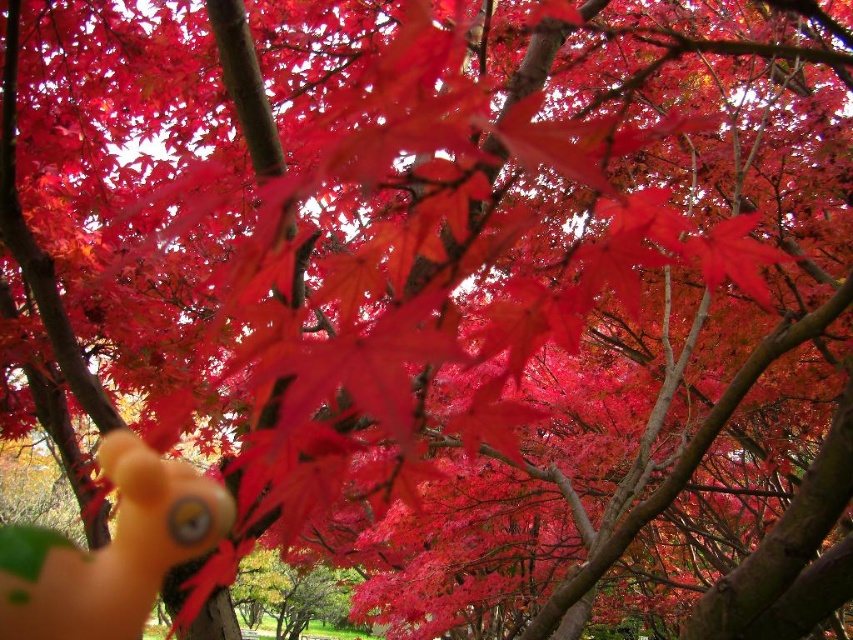
Question: Which point is closer to the camera?

Choices:
 (A) (117, 518)
 (B) (747, 291)

Answer: (A)

Question: Among these objects, which one is nearest to the camera?

Choices:
 (A) glossy red maple leaf at upper right
 (B) rubber duck at lower left

Answer: (B)

Question: Can you confirm if rubber duck at lower left is positioned to the left of glossy red maple leaf at upper right?

Choices:
 (A) yes
 (B) no

Answer: (A)

Question: Observing the image, what is the correct spatial positioning of rubber duck at lower left in reference to glossy red maple leaf at upper right?

Choices:
 (A) below
 (B) above

Answer: (A)

Question: Can you confirm if rubber duck at lower left is wider than glossy red maple leaf at upper right?

Choices:
 (A) no
 (B) yes

Answer: (A)